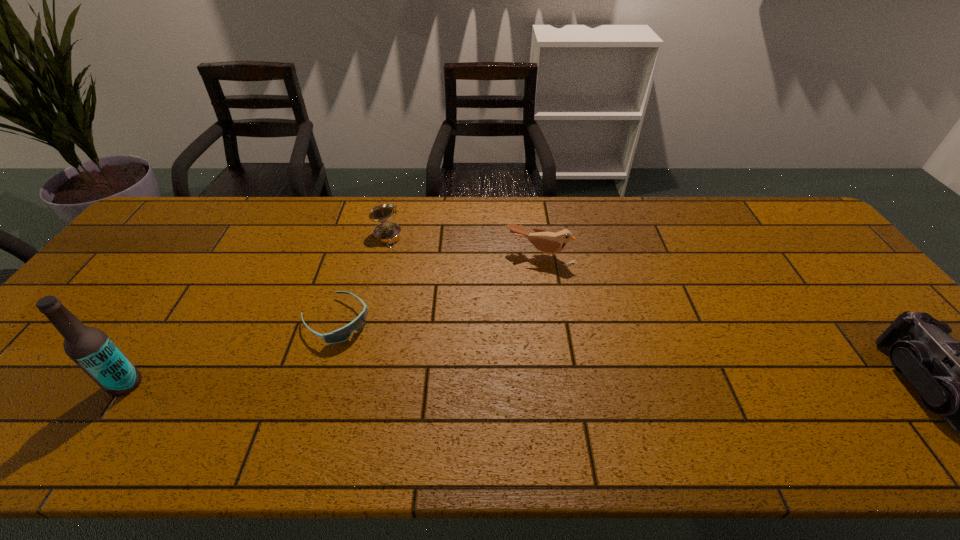
The width and height of the screenshot is (960, 540). Find the location of `blank space at the far right corner`. blank space at the far right corner is located at coordinates (776, 235).

Locate an element on the screen. This screenshot has height=540, width=960. vacant area that lies between the second object from right to left and the compass is located at coordinates (464, 246).

You are a GUI agent. You are given a task and a screenshot of the screen. Output one action in this format:
    pyautogui.click(x=<x>, y=<y>)
    Task: Click on the empty space between the beer bottle and the bird
    The height and width of the screenshot is (540, 960).
    Given the screenshot: What is the action you would take?
    pyautogui.click(x=333, y=320)

Identify the location of vacant area between the shortest object and the tallest object. (230, 352).

Image resolution: width=960 pixels, height=540 pixels. What are the coordinates of `vacant area that lies between the compass and the tallest object` in the screenshot? It's located at (256, 310).

At what (x,y) coordinates should I click in order to perform the action: click on free space between the shortest object and the compass. Please return your answer as a coordinate pair (x, y). This screenshot has width=960, height=540. Looking at the image, I should click on (361, 278).

Where is `vacant area between the bird and the compass`? The width and height of the screenshot is (960, 540). vacant area between the bird and the compass is located at coordinates (464, 246).

Find the location of a particular element. object that is the third closest to the bird is located at coordinates (959, 380).

Identify which object is the third nearest to the beer bottle. Please provide its 2D coordinates. Your answer should be formatted as a tuple, i.e. [(x, y)], where the tuple contains the x and y coordinates of a point satisfying the conditions above.

[(547, 242)]